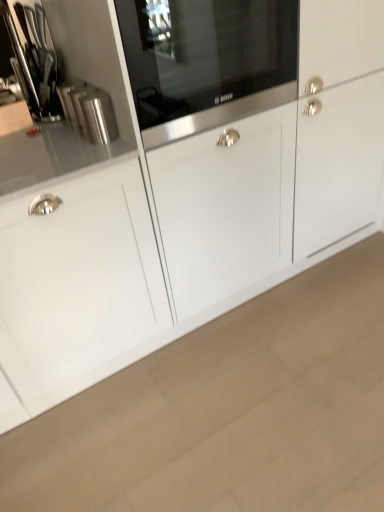
Question: Considering the relative positions of polished stainless steel canister at left and stainless steel microwave at center in the image provided, is polished stainless steel canister at left behind stainless steel microwave at center?

Choices:
 (A) yes
 (B) no

Answer: (A)

Question: Is polished stainless steel canister at left wider than stainless steel microwave at center?

Choices:
 (A) yes
 (B) no

Answer: (B)

Question: Is polished stainless steel canister at left shorter than stainless steel microwave at center?

Choices:
 (A) no
 (B) yes

Answer: (B)

Question: Is polished stainless steel canister at left turned away from stainless steel microwave at center?

Choices:
 (A) no
 (B) yes

Answer: (A)

Question: Does polished stainless steel canister at left lie in front of stainless steel microwave at center?

Choices:
 (A) yes
 (B) no

Answer: (B)

Question: Is polished stainless steel knife block at upper left situated inside polished stainless steel canister at left or outside?

Choices:
 (A) outside
 (B) inside

Answer: (A)

Question: Is polished stainless steel knife block at upper left in front of or behind polished stainless steel canister at left in the image?

Choices:
 (A) front
 (B) behind

Answer: (B)

Question: In the image, is polished stainless steel knife block at upper left on the left side or the right side of polished stainless steel canister at left?

Choices:
 (A) left
 (B) right

Answer: (A)

Question: In terms of size, does polished stainless steel knife block at upper left appear bigger or smaller than polished stainless steel canister at left?

Choices:
 (A) big
 (B) small

Answer: (A)

Question: Does point (94, 118) appear closer or farther from the camera than point (54, 98)?

Choices:
 (A) farther
 (B) closer

Answer: (B)

Question: Considering the positions of polished stainless steel canister at left and polished stainless steel knife block at upper left in the image, is polished stainless steel canister at left wider or thinner than polished stainless steel knife block at upper left?

Choices:
 (A) thin
 (B) wide

Answer: (B)

Question: From the image's perspective, relative to polished stainless steel knife block at upper left, is polished stainless steel canister at left above or below?

Choices:
 (A) above
 (B) below

Answer: (B)

Question: Considering their positions, is polished stainless steel canister at left located in front of or behind polished stainless steel knife block at upper left?

Choices:
 (A) front
 (B) behind

Answer: (A)

Question: Relative to stainless steel microwave at center, is polished stainless steel knife block at upper left in front or behind?

Choices:
 (A) front
 (B) behind

Answer: (B)

Question: From their relative heights in the image, would you say polished stainless steel knife block at upper left is taller or shorter than stainless steel microwave at center?

Choices:
 (A) tall
 (B) short

Answer: (B)